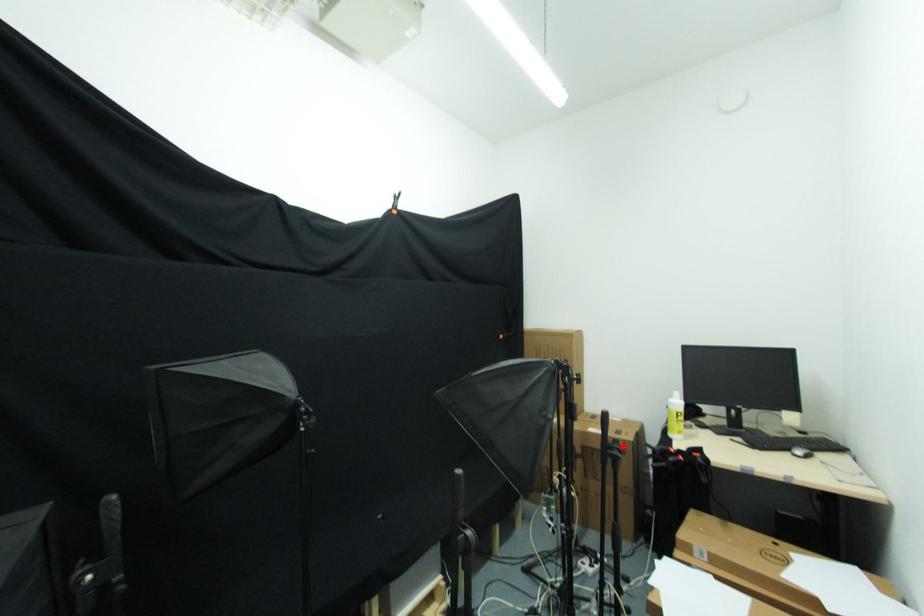
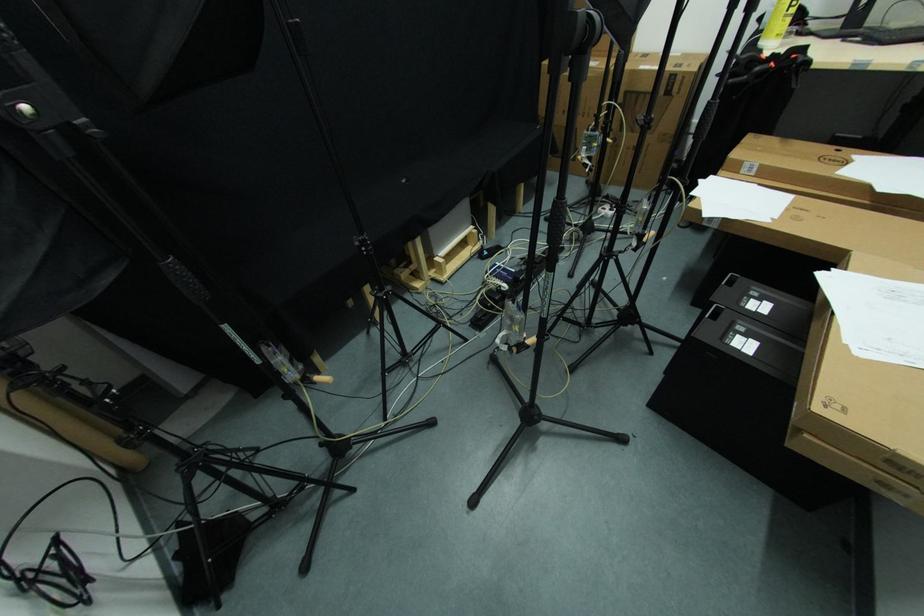
Locate, in the second image, the point that corresponds to the highlighted location in the first image.

(679, 81)